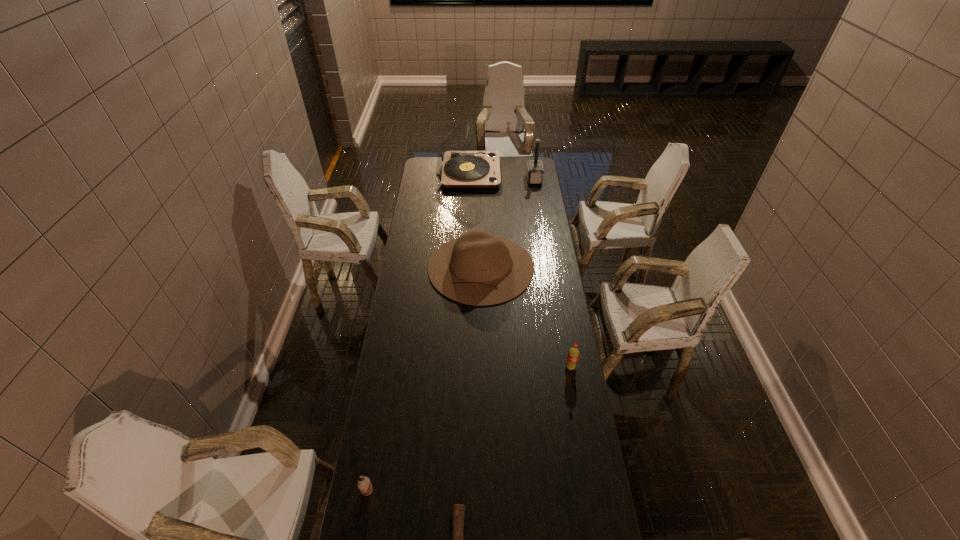
This screenshot has height=540, width=960. I want to click on vacant space that satisfies the following two spatial constraints: 1. on the front side of the fourth tallest object; 2. on the left side of the sombrero, so click(481, 367).

I want to click on free space that satisfies the following two spatial constraints: 1. on the back side of the third nearest object; 2. with the tonearm facing the front of the tallest object, so click(x=538, y=173).

Locate an element on the screen. vacant space that satisfies the following two spatial constraints: 1. with the tonearm facing the front of the record player; 2. on the left side of the sombrero is located at coordinates (466, 267).

Where is `free spot that satisfies the following two spatial constraints: 1. with the tonearm facing the front of the tallest object; 2. on the back side of the fourth farthest object`? free spot that satisfies the following two spatial constraints: 1. with the tonearm facing the front of the tallest object; 2. on the back side of the fourth farthest object is located at coordinates (462, 367).